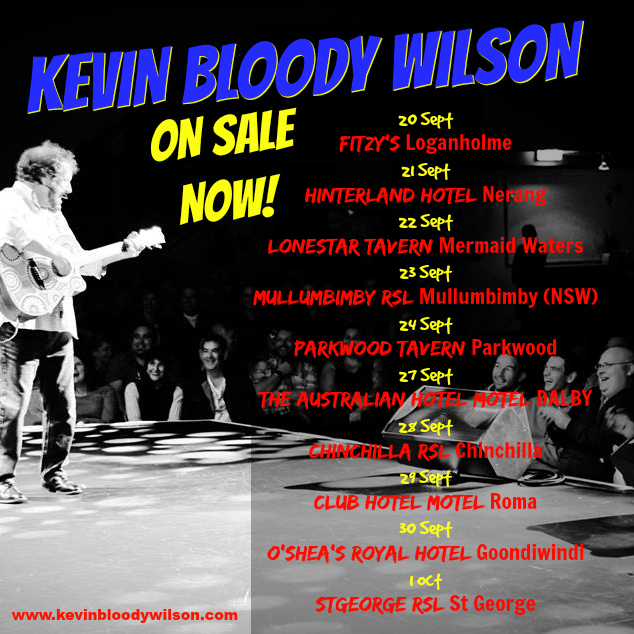
I want to click on light, so click(x=548, y=160).